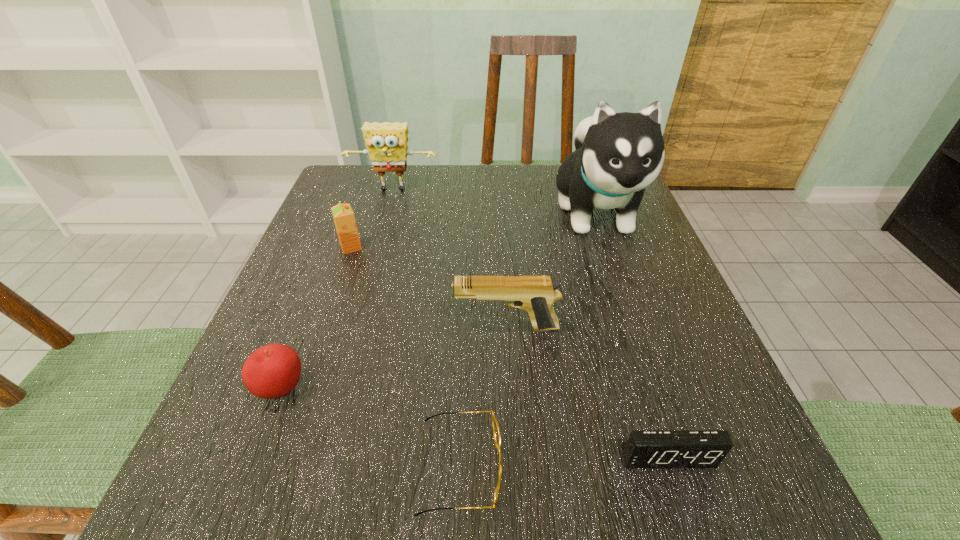
Locate an element on the screen. The image size is (960, 540). the tallest object is located at coordinates (617, 155).

Where is `the second tallest object`? The width and height of the screenshot is (960, 540). the second tallest object is located at coordinates (386, 142).

Locate an element on the screen. The width and height of the screenshot is (960, 540). the fourth nearest object is located at coordinates (535, 294).

The image size is (960, 540). Identify the location of orange juice. (344, 219).

Find the location of `the third shortest object`. the third shortest object is located at coordinates (272, 371).

Find the location of a particular element. The height and width of the screenshot is (540, 960). the third nearest object is located at coordinates click(272, 371).

Find the location of a particular element. Image resolution: width=960 pixels, height=540 pixels. alarm clock is located at coordinates (645, 448).

Identify the location of the shortest object. The width and height of the screenshot is (960, 540). (496, 430).

The image size is (960, 540). In order to click on vacant space located 0.140m at the face of the tallest object in this screenshot , I will do `click(631, 312)`.

In order to click on free point located 0.380m on the face of the sponge in this screenshot , I will do `click(358, 315)`.